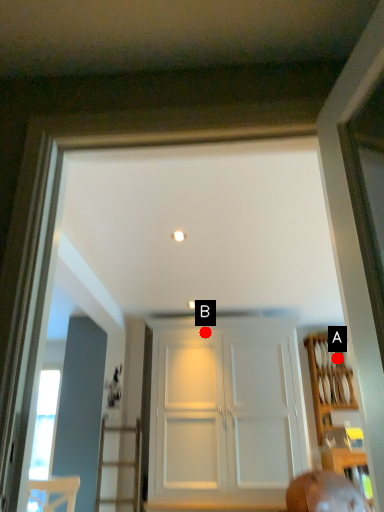
Question: Two points are circled on the image, labeled by A and B beside each circle. Which of the following is the farthest from the observer?

Choices:
 (A) A is further
 (B) B is further

Answer: (A)